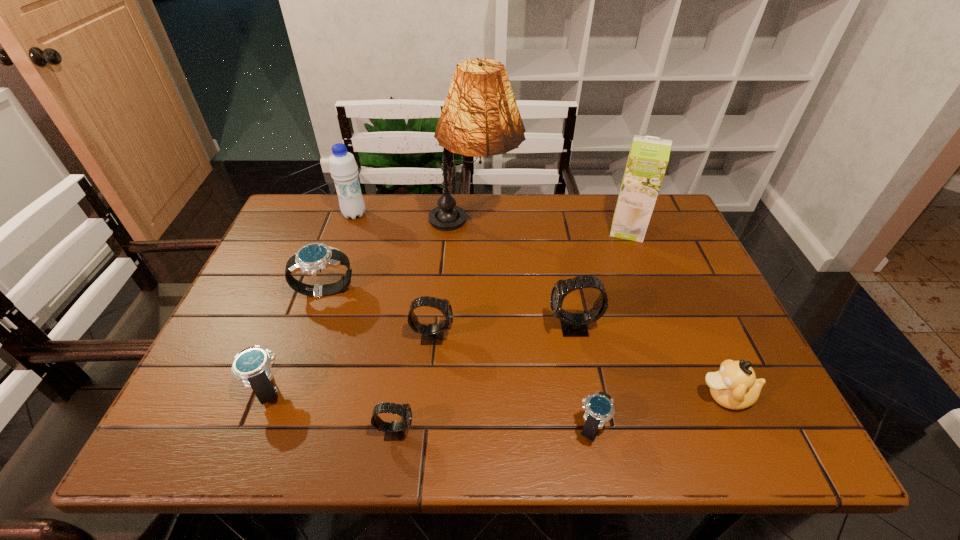
Where is `free space between the shortest object and the second smallest silver watch`? The height and width of the screenshot is (540, 960). free space between the shortest object and the second smallest silver watch is located at coordinates (430, 408).

In order to click on vacant point located between the smallest gray watch and the shortest watch in this screenshot , I will do `click(494, 429)`.

You are a GUI agent. You are given a task and a screenshot of the screen. Output one action in this format:
    pyautogui.click(x=<x>, y=<y>)
    Task: Click on the object that stands as the fifth closest to the shortest watch
    This screenshot has width=960, height=540.
    Given the screenshot: What is the action you would take?
    pyautogui.click(x=480, y=117)

Locate which object is the ninth closest to the second smallest silver watch. Please provide its 2D coordinates. Your answer should be formatted as a tuple, i.e. [(x, y)], where the tuple contains the x and y coordinates of a point satisfying the conditions above.

[(648, 158)]

Select which watch is the third closest to the second biggest silver watch. Please provide its 2D coordinates. Your answer should be formatted as a tuple, i.e. [(x, y)], where the tuple contains the x and y coordinates of a point satisfying the conditions above.

[(432, 334)]

You are a GUI agent. You are given a task and a screenshot of the screen. Output one action in this format:
    pyautogui.click(x=<x>, y=<y>)
    Task: Click on the watch that stands as the fourth closest to the tallest watch
    The width and height of the screenshot is (960, 540).
    Given the screenshot: What is the action you would take?
    pyautogui.click(x=313, y=258)

This screenshot has width=960, height=540. Find the location of `gray watch that is the closest to the smallest gray watch`. gray watch that is the closest to the smallest gray watch is located at coordinates (432, 334).

The width and height of the screenshot is (960, 540). Identify the location of the closest gray watch to the lampshade. (573, 324).

Where is `silver watch that is the second closest to the smallest gray watch`? Image resolution: width=960 pixels, height=540 pixels. silver watch that is the second closest to the smallest gray watch is located at coordinates pyautogui.click(x=599, y=407).

Locate which silver watch is the second closest to the farthest silver watch. Please provide its 2D coordinates. Your answer should be formatted as a tuple, i.e. [(x, y)], where the tuple contains the x and y coordinates of a point satisfying the conditions above.

[(599, 407)]